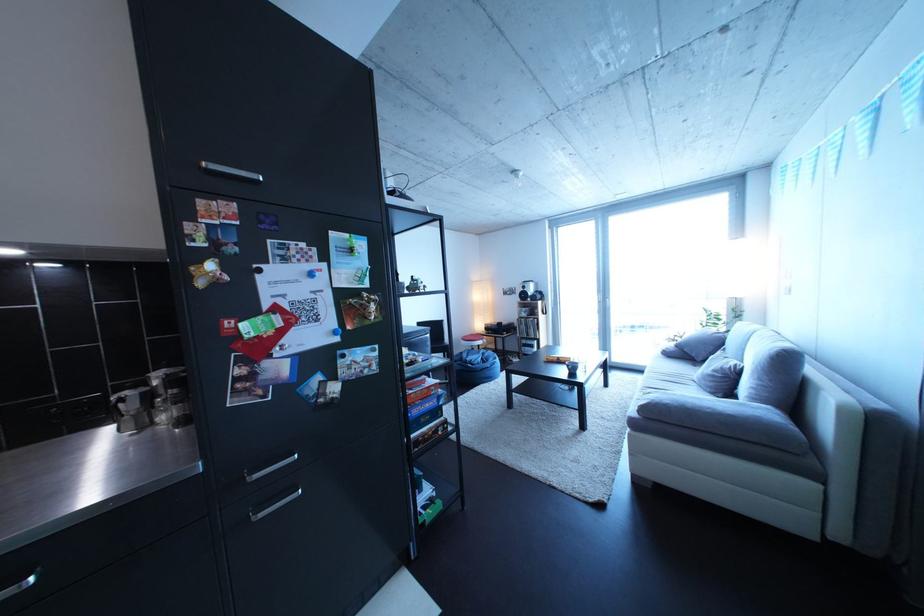
Image resolution: width=924 pixels, height=616 pixels. Describe the element at coordinates (572, 367) in the screenshot. I see `a small black bowl` at that location.